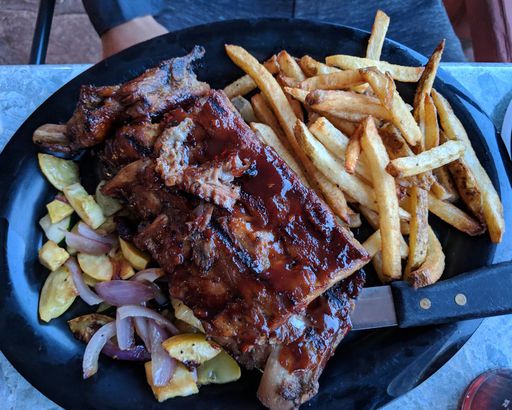
Locate an element on the screen. floor is located at coordinates (60, 48), (2, 36).